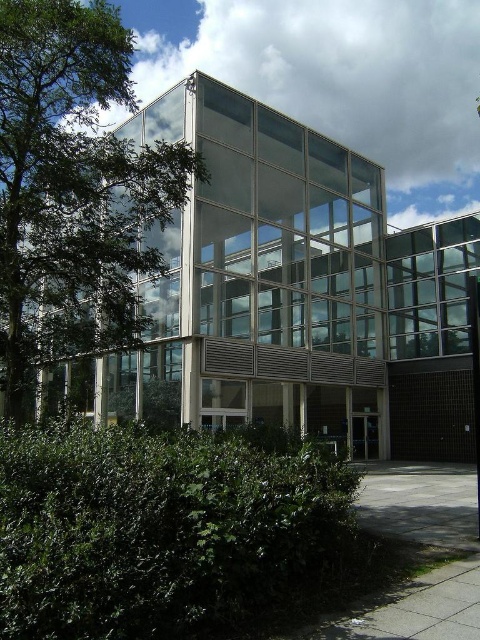
Which is behind, point (203, 516) or point (56, 342)?

Positioned behind is point (56, 342).

Does green leafy bush at lower left have a larger size compared to green leafy tree at left?

Correct, green leafy bush at lower left is larger in size than green leafy tree at left.

Between point (228, 550) and point (85, 248), which one is positioned in front?

Point (228, 550) is in front.

Identify the location of green leafy bush at lower left. The height and width of the screenshot is (640, 480). (159, 529).